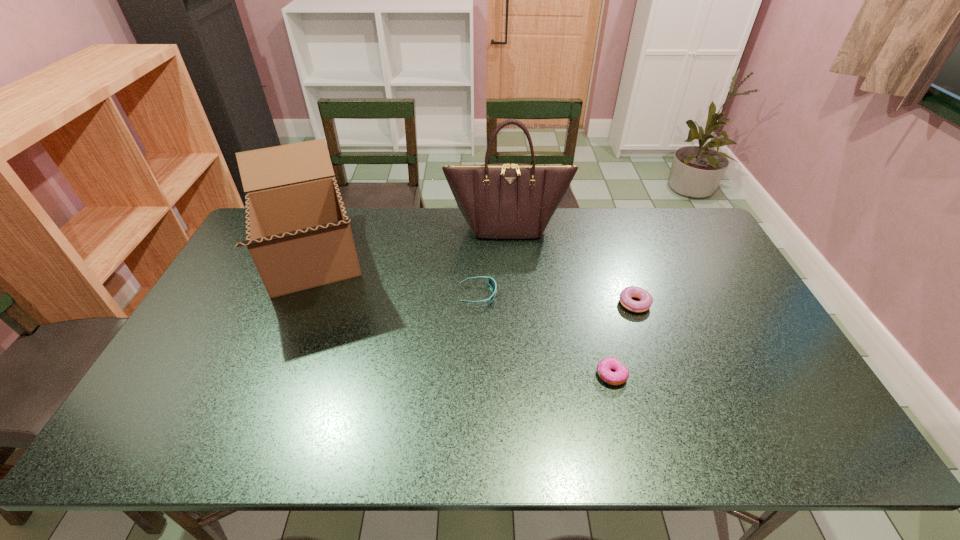
This screenshot has width=960, height=540. Identify the location of free location that satisfies the following two spatial constraints: 1. on the front-facing side of the right doughnut; 2. on the right side of the handbag. (513, 305).

The image size is (960, 540). Find the location of `free spot that satisfies the following two spatial constraints: 1. on the front-facing side of the handbag; 2. on the front-facing side of the sunglasses`. free spot that satisfies the following two spatial constraints: 1. on the front-facing side of the handbag; 2. on the front-facing side of the sunglasses is located at coordinates (512, 295).

At what (x,y) coordinates should I click in order to perform the action: click on vacant area that satisfies the following two spatial constraints: 1. on the front-facing side of the tallest object; 2. on the left side of the nearest object. Please return your answer as a coordinate pair (x, y). Looking at the image, I should click on (518, 375).